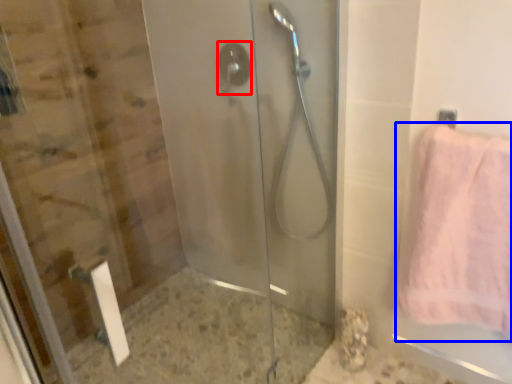
Question: Among these objects, which one is nearest to the camera, shower (highlighted by a red box) or towel (highlighted by a blue box)?

Choices:
 (A) shower
 (B) towel

Answer: (B)